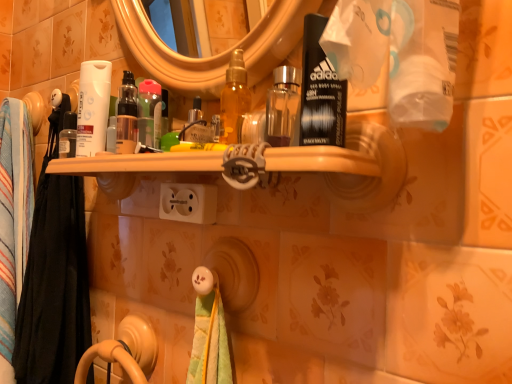
What is the approximate width of translucent plastic bottle at center?

translucent plastic bottle at center is 1.52 inches wide.

Measure the distance between point (1, 134) and camera.

Point (1, 134) is 99.00 centimeters away from camera.

Find the location of a particular element. The height and width of the screenshot is (384, 512). white matte tube at left is located at coordinates (93, 107).

Considering the positions of objects white plastic outlet at center and black fabric towel at left, placed as the first bath towel when sorted from back to front, in the image provided, who is more to the right, white plastic outlet at center or black fabric towel at left, placed as the first bath towel when sorted from back to front,?

white plastic outlet at center is more to the right.

Does white plastic outlet at center turn towards black fabric towel at left, which is counted as the second bath towel, starting from the front?

No, white plastic outlet at center is not aimed at black fabric towel at left, which is counted as the second bath towel, starting from the front.

Considering the positions of objects white plastic outlet at center and black fabric towel at left, which is counted as the second bath towel, starting from the front, in the image provided, who is in front, white plastic outlet at center or black fabric towel at left, which is counted as the second bath towel, starting from the front,?

white plastic outlet at center.

How different are the orientations of white plastic outlet at center and black fabric towel at left, which is counted as the second bath towel, starting from the front, in degrees?

5.3 degrees.

Consider the image. From a real-world perspective, is black fabric towel at left, which is counted as the second bath towel, starting from the front, positioned above or below multicolored fabric towel at left, the first bath towel when ordered from front to back?

From a real-world perspective, black fabric towel at left, which is counted as the second bath towel, starting from the front, is physically below multicolored fabric towel at left, the first bath towel when ordered from front to back.

Does black fabric towel at left, which is counted as the second bath towel, starting from the front, have a greater height compared to multicolored fabric towel at left, the first bath towel when ordered from front to back?

Yes.

In the scene shown: Which is more to the left, black fabric towel at left, placed as the first bath towel when sorted from back to front, or multicolored fabric towel at left, the first bath towel when ordered from front to back?

From the viewer's perspective, black fabric towel at left, placed as the first bath towel when sorted from back to front, appears more on the left side.

Find the location of a particular element. bath towel beneath the multicolored fabric towel at left, the first bath towel when ordered from front to back (from a real-world perspective) is located at coordinates (13, 220).

From the image's perspective, between translucent plastic bottle at center and white plastic outlet at center, who is located below?

white plastic outlet at center appears lower in the image.

Is point (156, 126) positioned behind point (211, 197)?

Yes, point (156, 126) is farther from viewer.

Could white plastic outlet at center be considered to be inside translucent plastic bottle at center?

No, translucent plastic bottle at center does not contain white plastic outlet at center.

Between translucent plastic bottle at center and white plastic outlet at center, which one has smaller width?

translucent plastic bottle at center.

Considering the sizes of objects black fabric towel at left, placed as the first bath towel when sorted from back to front, and translucent plastic bottle at center in the image provided, who is bigger, black fabric towel at left, placed as the first bath towel when sorted from back to front, or translucent plastic bottle at center?

black fabric towel at left, placed as the first bath towel when sorted from back to front, is bigger.

From the image's perspective, is black fabric towel at left, which is counted as the second bath towel, starting from the front, above or below translucent plastic bottle at center?

black fabric towel at left, which is counted as the second bath towel, starting from the front, is below translucent plastic bottle at center.

Which is less distant, (9, 281) or (158, 148)?

Point (9, 281).

Can you confirm if black fabric towel at left, placed as the first bath towel when sorted from back to front, is positioned to the left of translucent plastic bottle at center?

Indeed, black fabric towel at left, placed as the first bath towel when sorted from back to front, is positioned on the left side of translucent plastic bottle at center.

Which of these two, translucent plastic bottle at center or black fabric towel at left, placed as the first bath towel when sorted from back to front, stands taller?

black fabric towel at left, placed as the first bath towel when sorted from back to front, is taller.

Who is bigger, translucent plastic bottle at center or black fabric towel at left, placed as the first bath towel when sorted from back to front?

With larger size is black fabric towel at left, placed as the first bath towel when sorted from back to front.

Between translucent plastic bottle at center and black fabric towel at left, which is counted as the second bath towel, starting from the front, which one appears on the left side from the viewer's perspective?

From the viewer's perspective, black fabric towel at left, which is counted as the second bath towel, starting from the front, appears more on the left side.

Are multicolored fabric towel at left, the first bath towel when ordered from front to back, and white plastic outlet at center beside each other?

They are not placed beside each other.

How different are the orientations of multicolored fabric towel at left, the first bath towel when ordered from front to back, and white plastic outlet at center in degrees?

They differ by 5.3 degrees in their facing directions.

Between multicolored fabric towel at left, which ranks as the 2th bath towel in back-to-front order, and white plastic outlet at center, which one has larger width?

multicolored fabric towel at left, which ranks as the 2th bath towel in back-to-front order.

From a real-world perspective, which object rests below the other?

In real-world perspective, multicolored fabric towel at left, the first bath towel when ordered from front to back, is lower.

Which object is more forward, black fabric towel at left, which is counted as the second bath towel, starting from the front, or white plastic outlet at center?

white plastic outlet at center.

From the image's perspective, does black fabric towel at left, which is counted as the second bath towel, starting from the front, appear lower than white plastic outlet at center?

Yes, from the image's perspective, black fabric towel at left, which is counted as the second bath towel, starting from the front, is below white plastic outlet at center.

Could you measure the distance between black fabric towel at left, placed as the first bath towel when sorted from back to front, and white plastic outlet at center?

black fabric towel at left, placed as the first bath towel when sorted from back to front, and white plastic outlet at center are 20.20 inches apart from each other.

At what (x,y) coordinates should I click in order to perform the action: click on the 2nd bath towel positioned below the white plastic outlet at center (from the image's perspective). Please return your answer as a coordinate pair (x, y). The height and width of the screenshot is (384, 512). Looking at the image, I should click on (13, 220).

In the image, there is a black fabric towel at left, which is counted as the second bath towel, starting from the front. Where is `bath towel above it (from the image's perspective)`? This screenshot has height=384, width=512. bath towel above it (from the image's perspective) is located at coordinates (54, 282).

Based on their spatial positions, is translucent plastic bottle at center or black fabric towel at left, which is counted as the second bath towel, starting from the front, further from multicolored fabric towel at left, which ranks as the 2th bath towel in back-to-front order?

Among the two, translucent plastic bottle at center is located further to multicolored fabric towel at left, which ranks as the 2th bath towel in back-to-front order.

Looking at the image, which one is located closer to white plastic outlet at center, translucent plastic bottle at center or black fabric towel at left, placed as the first bath towel when sorted from back to front?

translucent plastic bottle at center is closer to white plastic outlet at center.

Looking at the image, which one is located closer to black fabric towel at left, placed as the first bath towel when sorted from back to front, multicolored fabric towel at left, the first bath towel when ordered from front to back, or white matte tube at left?

Based on the image, multicolored fabric towel at left, the first bath towel when ordered from front to back, appears to be nearer to black fabric towel at left, placed as the first bath towel when sorted from back to front.

Looking at the image, which one is located closer to multicolored fabric towel at left, the first bath towel when ordered from front to back, white matte tube at left or white plastic outlet at center?

white matte tube at left.

Based on their spatial positions, is white plastic outlet at center or translucent plastic bottle at center further from black fabric towel at left, which is counted as the second bath towel, starting from the front?

translucent plastic bottle at center lies further to black fabric towel at left, which is counted as the second bath towel, starting from the front, than the other object.

From the picture: Looking at the image, which one is located further to white matte tube at left, multicolored fabric towel at left, the first bath towel when ordered from front to back, or black fabric towel at left, placed as the first bath towel when sorted from back to front?

black fabric towel at left, placed as the first bath towel when sorted from back to front, is further to white matte tube at left.

Looking at the image, which one is located further to black fabric towel at left, which is counted as the second bath towel, starting from the front, translucent plastic bottle at center or white plastic outlet at center?

translucent plastic bottle at center.

Based on their spatial positions, is black fabric towel at left, which is counted as the second bath towel, starting from the front, or white plastic outlet at center closer to translucent plastic bottle at center?

white plastic outlet at center lies closer to translucent plastic bottle at center than the other object.

At what (x,y) coordinates should I click in order to perform the action: click on mouthwash between multicolored fabric towel at left, which ranks as the 2th bath towel in back-to-front order, and white plastic outlet at center, in the horizontal direction. Please return your answer as a coordinate pair (x, y). The image size is (512, 384). Looking at the image, I should click on (149, 113).

Identify the location of toilet paper between black fabric towel at left, placed as the first bath towel when sorted from back to front, and white plastic outlet at center. (93, 107).

Find the location of a particular element. bath towel located between black fabric towel at left, placed as the first bath towel when sorted from back to front, and translucent plastic bottle at center in the left-right direction is located at coordinates (54, 282).

Identify the location of bath towel between black fabric towel at left, which is counted as the second bath towel, starting from the front, and white matte tube at left, in the horizontal direction. (54, 282).